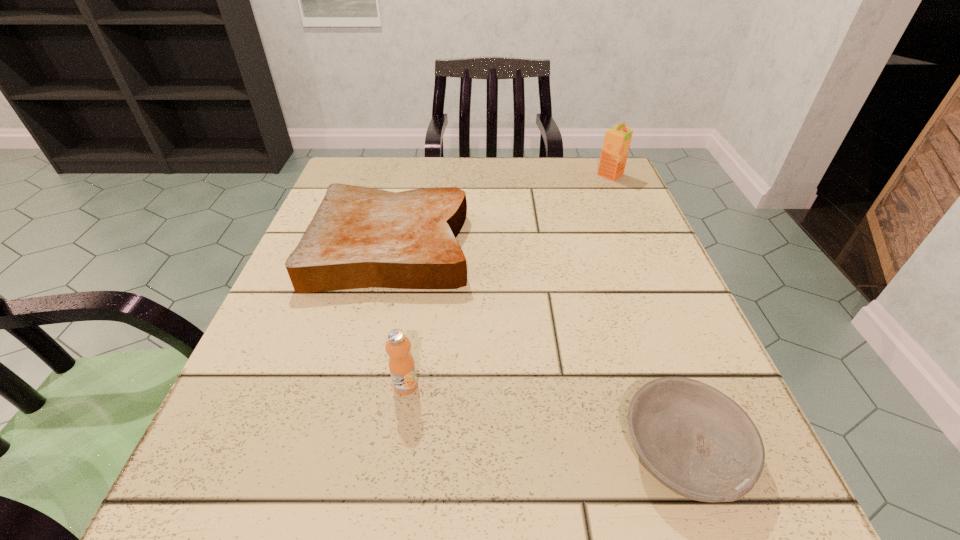
Identify the location of empty location between the left orange juice and the farther orange juice. This screenshot has width=960, height=540. (508, 280).

Find the location of a particular element. vacant area between the nearer orange juice and the second farthest object is located at coordinates (398, 315).

The height and width of the screenshot is (540, 960). I want to click on vacant point located between the third nearest object and the bowl, so click(x=538, y=348).

This screenshot has width=960, height=540. I want to click on free space between the tallest object and the left orange juice, so click(508, 280).

Locate an element on the screen. The width and height of the screenshot is (960, 540). empty space that is in between the farthest object and the bowl is located at coordinates (647, 313).

Locate an element on the screen. This screenshot has height=540, width=960. free space between the bread and the bowl is located at coordinates (538, 348).

Find the location of `vacant point located between the nearest object and the shorter orange juice`. vacant point located between the nearest object and the shorter orange juice is located at coordinates (544, 418).

Locate an element on the screen. unoccupied position between the left orange juice and the taller orange juice is located at coordinates (508, 280).

The height and width of the screenshot is (540, 960). What are the coordinates of `object identified as the closest to the bread` in the screenshot? It's located at (401, 363).

The height and width of the screenshot is (540, 960). In order to click on object that is the third nearest to the third farthest object in this screenshot , I will do `click(617, 139)`.